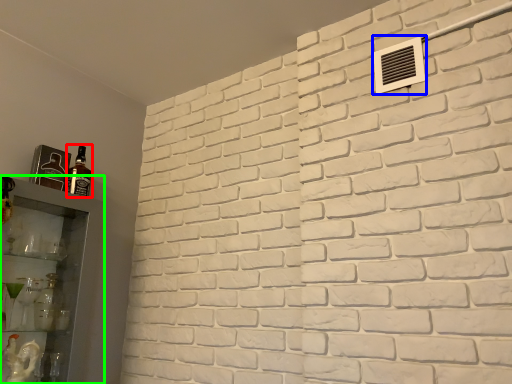
Question: Which object is the closest to the bottle (highlighted by a red box)? Choose among these: air conditioning (highlighted by a blue box) or shelf (highlighted by a green box).

Choices:
 (A) air conditioning
 (B) shelf

Answer: (B)